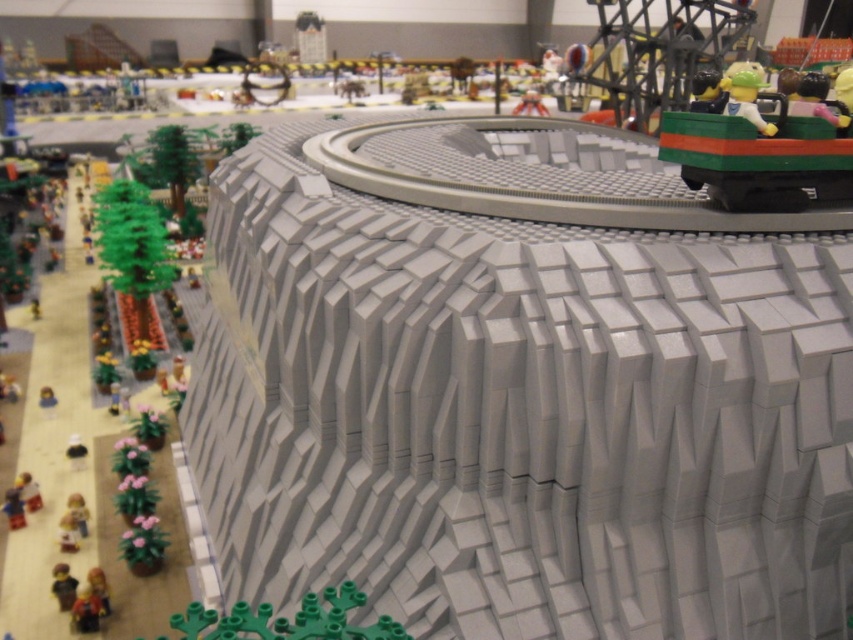
Is green matte figure at upper right wider than translucent plastic cup at upper center?

Incorrect, green matte figure at upper right's width does not surpass translucent plastic cup at upper center's.

Is point (746, 93) closer to viewer compared to point (514, 115)?

Yes, point (746, 93) is closer to viewer.

Locate an element on the screen. green matte figure at upper right is located at coordinates 746,99.

Which is above, green plastic car at upper right or green matte figure at upper right?

green matte figure at upper right is higher up.

Who is more distant from viewer, (x=767, y=125) or (x=741, y=97)?

Positioned behind is point (x=741, y=97).

Who is more forward, (729,77) or (759,115)?

Point (759,115) is more forward.

At what (x,y) coordinates should I click in order to perform the action: click on green plastic car at upper right. Please return your answer as a coordinate pair (x, y). Looking at the image, I should click on (764, 145).

Between green plastic car at upper right and translucent plastic cup at upper center, which one is positioned higher?

translucent plastic cup at upper center is above.

Can you confirm if green plastic car at upper right is positioned to the right of translucent plastic cup at upper center?

Indeed, green plastic car at upper right is positioned on the right side of translucent plastic cup at upper center.

Image resolution: width=853 pixels, height=640 pixels. What do you see at coordinates (764, 145) in the screenshot? I see `green plastic car at upper right` at bounding box center [764, 145].

The height and width of the screenshot is (640, 853). I want to click on green plastic car at upper right, so click(x=764, y=145).